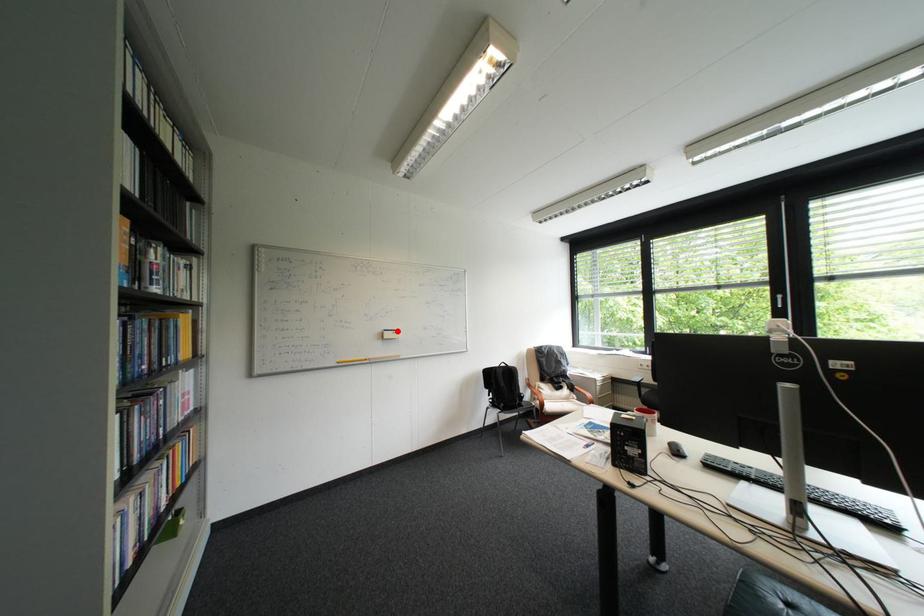
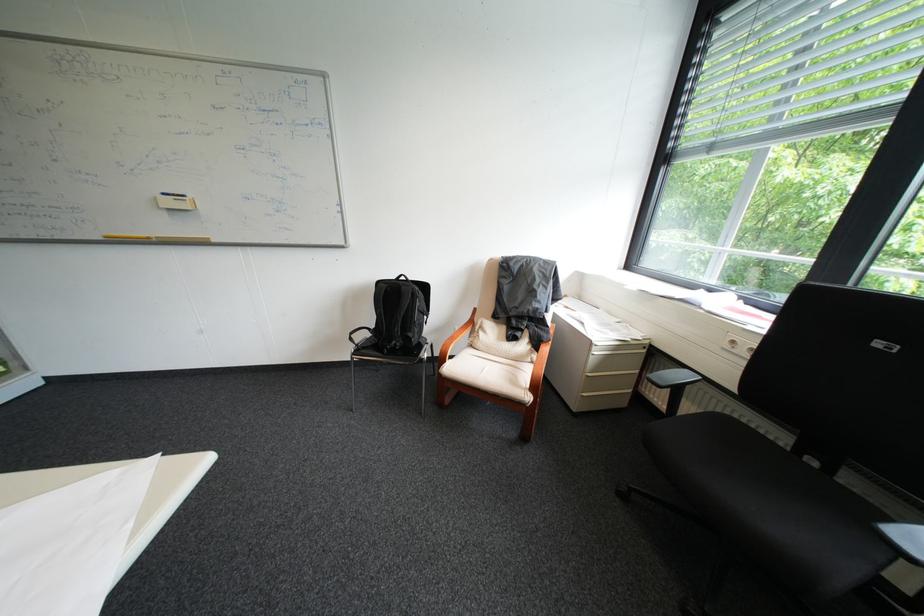
Where in the second image is the point corresponding to the highlighted location from the first image?

(176, 195)